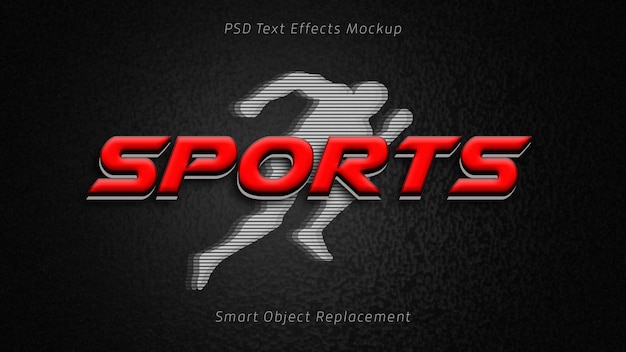
The height and width of the screenshot is (352, 626). In order to click on corners image in this screenshot , I will do `click(621, 348)`, `click(625, 0)`, `click(3, 1)`, `click(6, 346)`.